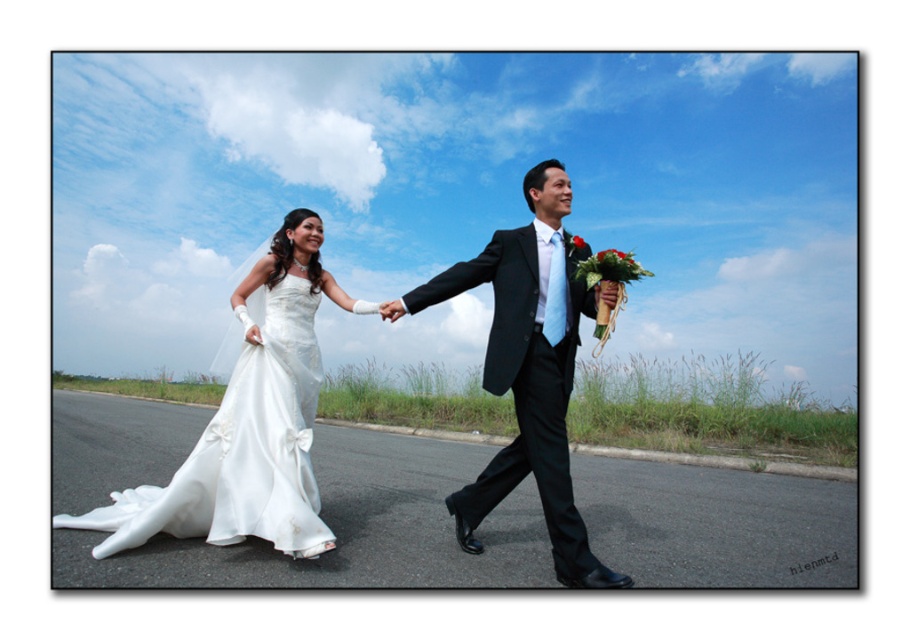
Between white satin dress at left and satin white gown at left, which one appears on the right side from the viewer's perspective?

Positioned to the right is white satin dress at left.

Can you confirm if white satin dress at left is smaller than satin white gown at left?

Yes, white satin dress at left is smaller than satin white gown at left.

Which is behind, point (546, 321) or point (239, 532)?

Positioned behind is point (239, 532).

The width and height of the screenshot is (910, 640). Identify the location of white satin dress at left. (248, 426).

Is satin white gown at left closer to the viewer compared to matte black suit at center?

No.

Is satin white gown at left to the left of matte black suit at center from the viewer's perspective?

Yes, satin white gown at left is to the left of matte black suit at center.

The height and width of the screenshot is (640, 910). Identify the location of satin white gown at left. (249, 420).

Which is above, white satin dress at left or matte black suit at center?

matte black suit at center is higher up.

Can you confirm if white satin dress at left is bigger than matte black suit at center?

Correct, white satin dress at left is larger in size than matte black suit at center.

I want to click on white satin dress at left, so coord(248,426).